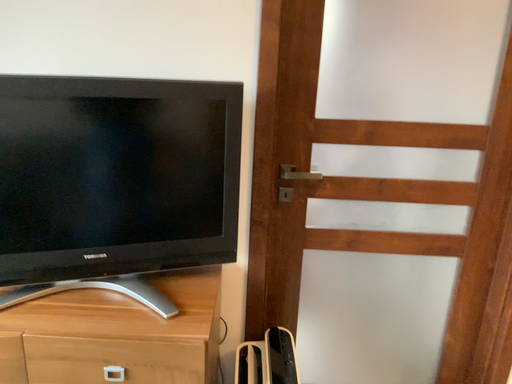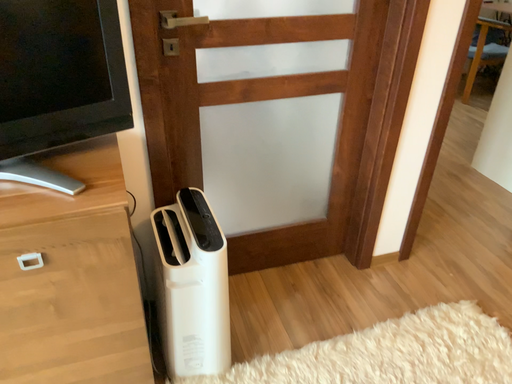
Question: How did the camera likely rotate when shooting the video?

Choices:
 (A) rotated upward
 (B) rotated downward

Answer: (B)